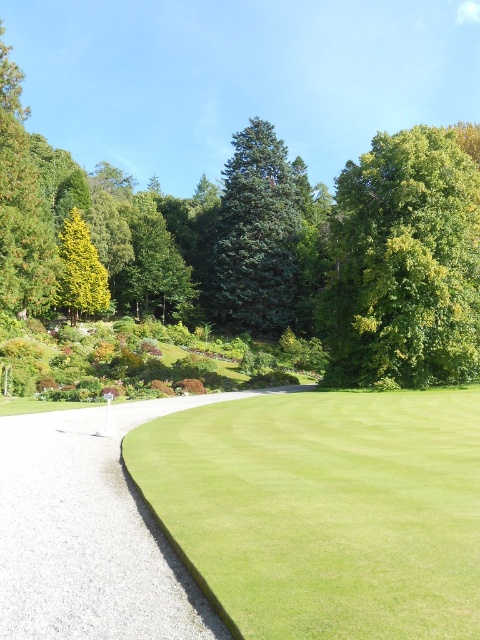
Based on the photo, which of these two, green smooth grass at center or gravelly path at lower left, stands shorter?

With less height is green smooth grass at center.

Does green smooth grass at center appear over gravelly path at lower left?

Yes.

Does point (296, 576) come farther from viewer compared to point (143, 419)?

No, (296, 576) is in front of (143, 419).

Identify the location of green smooth grass at center. This screenshot has width=480, height=640. (325, 509).

Does green leafy tree at upper center have a greater width compared to gravelly path at lower left?

Indeed, green leafy tree at upper center has a greater width compared to gravelly path at lower left.

Is point (400, 156) farther from viewer compared to point (90, 540)?

That is True.

Locate an element on the screen. The image size is (480, 640). green leafy tree at upper center is located at coordinates (275, 244).

Does green smooth grass at center appear on the left side of green leafy tree at upper right?

→ Correct, you'll find green smooth grass at center to the left of green leafy tree at upper right.

Who is lower down, green smooth grass at center or green leafy tree at upper right?

green smooth grass at center is below.

Which is in front, point (437, 433) or point (468, 300)?

Point (437, 433) is more forward.

At what (x,y) coordinates should I click in order to perform the action: click on green smooth grass at center. Please return your answer as a coordinate pair (x, y). Image resolution: width=480 pixels, height=640 pixels. Looking at the image, I should click on (325, 509).